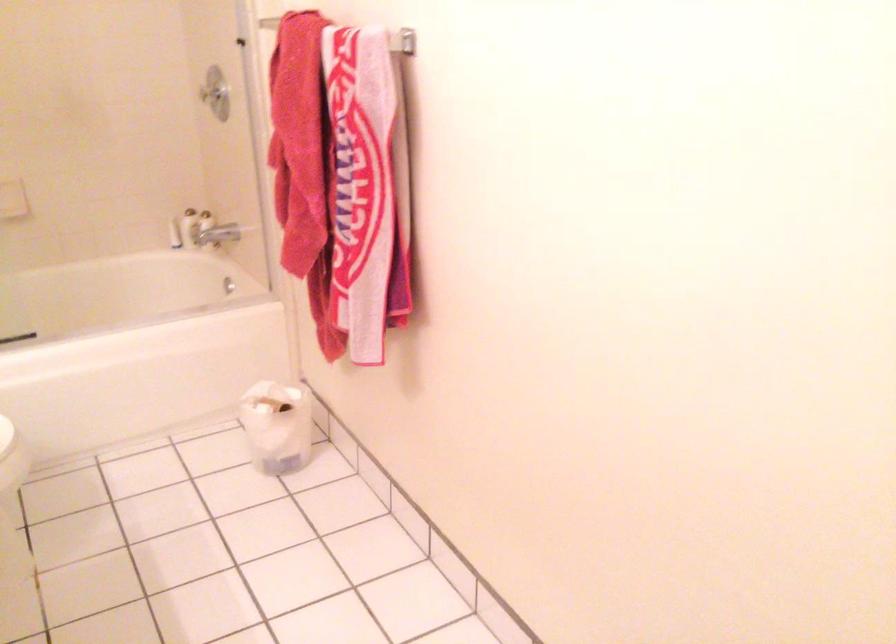
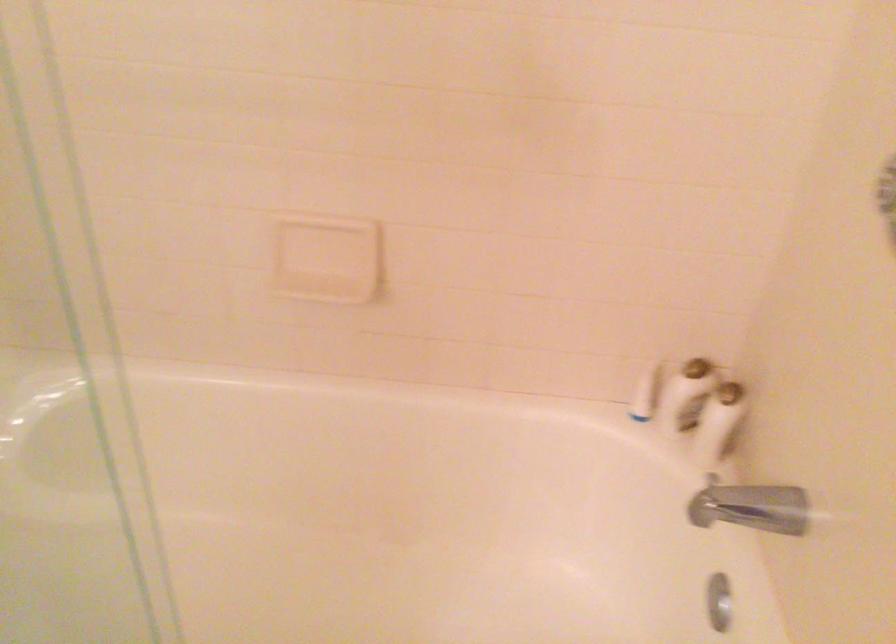
Find the pixel in the second image that matches pixel 230 281 in the first image.

(719, 601)